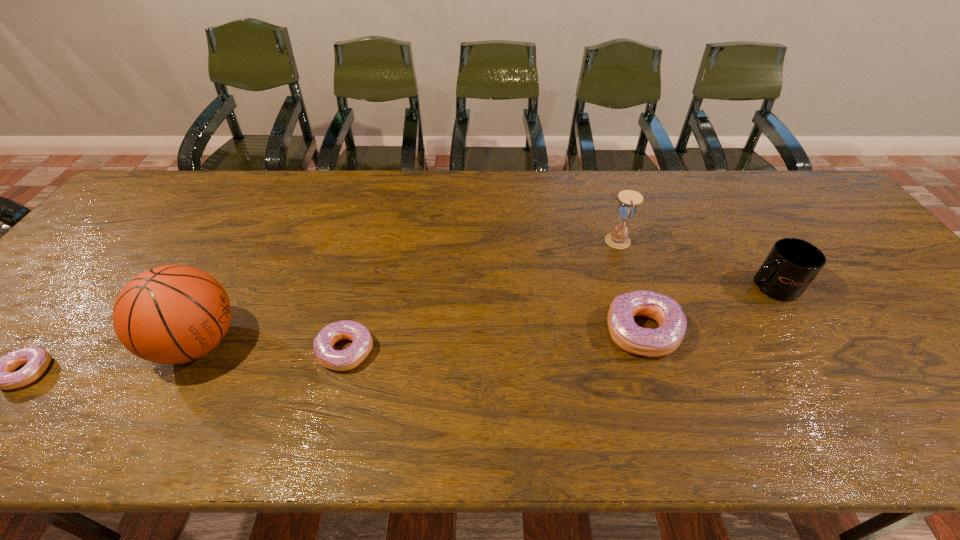
What are the coordinates of `object that is the fifth closest to the mug` in the screenshot? It's located at (0, 375).

Select which object appears as the third closest to the tallest object. Please provide its 2D coordinates. Your answer should be formatted as a tuple, i.e. [(x, y)], where the tuple contains the x and y coordinates of a point satisfying the conditions above.

[(630, 337)]

Choose which doughnut is the nearest neighbor to the third tallest object. Please provide its 2D coordinates. Your answer should be formatted as a tuple, i.e. [(x, y)], where the tuple contains the x and y coordinates of a point satisfying the conditions above.

[(630, 337)]

You are a GUI agent. You are given a task and a screenshot of the screen. Output one action in this format:
    pyautogui.click(x=<x>, y=<y>)
    Task: Click on the third closest doughnut to the hourglass
    This screenshot has height=540, width=960.
    Given the screenshot: What is the action you would take?
    pyautogui.click(x=0, y=375)

The image size is (960, 540). What are the coordinates of `vacant point that satisfies the following two spatial constraints: 1. on the back side of the third object from left to right; 2. on the left side of the hourglass` in the screenshot? It's located at (373, 240).

Locate an element on the screen. This screenshot has width=960, height=540. free location that satisfies the following two spatial constraints: 1. on the front side of the third object from left to right; 2. on the right side of the second object from left to right is located at coordinates (194, 351).

Locate an element on the screen. This screenshot has height=540, width=960. free space that satisfies the following two spatial constraints: 1. on the front side of the second doughnut from right to left; 2. on the left side of the tallest object is located at coordinates pyautogui.click(x=194, y=351).

Image resolution: width=960 pixels, height=540 pixels. Identify the location of free region that satisfies the following two spatial constraints: 1. with the handle on the side of the second farthest object; 2. on the front side of the second shortest object. (810, 351).